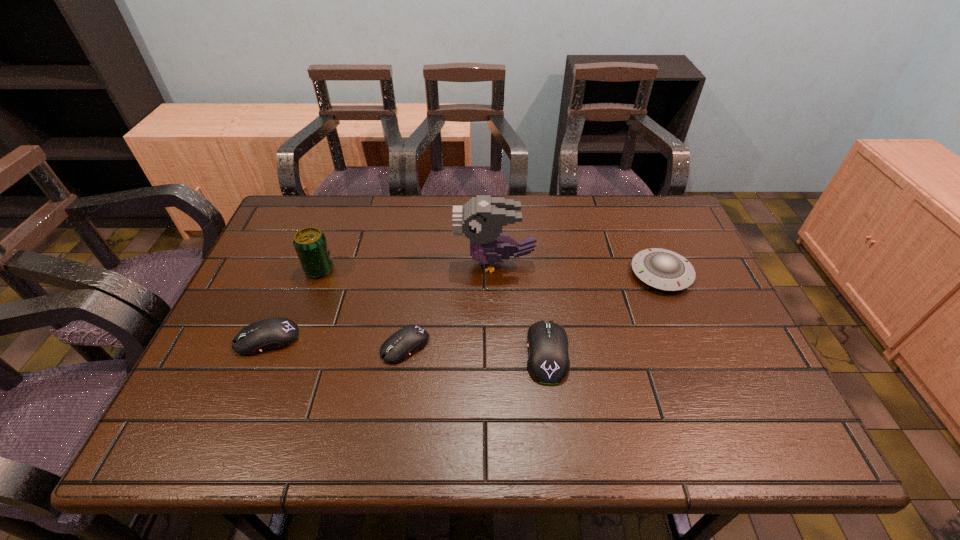
This screenshot has width=960, height=540. Identify the location of the leftmost computer equipment. (276, 333).

You are a GUI agent. You are given a task and a screenshot of the screen. Output one action in this format:
    pyautogui.click(x=<x>, y=<y>)
    Task: Click on the third object from left to right
    The width and height of the screenshot is (960, 540).
    Given the screenshot: What is the action you would take?
    pyautogui.click(x=399, y=346)

Locate an element on the screen. This screenshot has width=960, height=540. the shortest object is located at coordinates (399, 346).

Find the location of `the rightmost computer equipment`. the rightmost computer equipment is located at coordinates (548, 362).

Find the location of a particular element. the rightmost object is located at coordinates (663, 269).

The height and width of the screenshot is (540, 960). Find the location of `bird`. bird is located at coordinates (482, 219).

Image resolution: width=960 pixels, height=540 pixels. Find the location of `the second tallest object`. the second tallest object is located at coordinates click(x=310, y=243).

This screenshot has width=960, height=540. I want to click on vacant space located on the back of the leftmost computer equipment, so click(x=285, y=296).

This screenshot has height=540, width=960. Find the location of `blank space located 0.120m on the right of the shortest object`. blank space located 0.120m on the right of the shortest object is located at coordinates (479, 346).

Image resolution: width=960 pixels, height=540 pixels. I want to click on free location located on the right of the rightmost computer equipment, so pos(675,353).